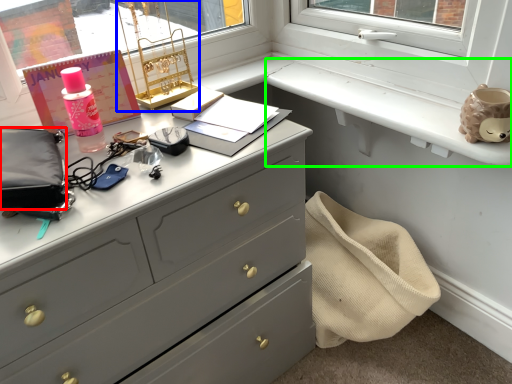
Question: Based on their relative distances, which object is farther from pouch (highlighted by a red box)? Choose from table lamp (highlighted by a blue box) and window sill (highlighted by a green box).

Choices:
 (A) table lamp
 (B) window sill

Answer: (B)